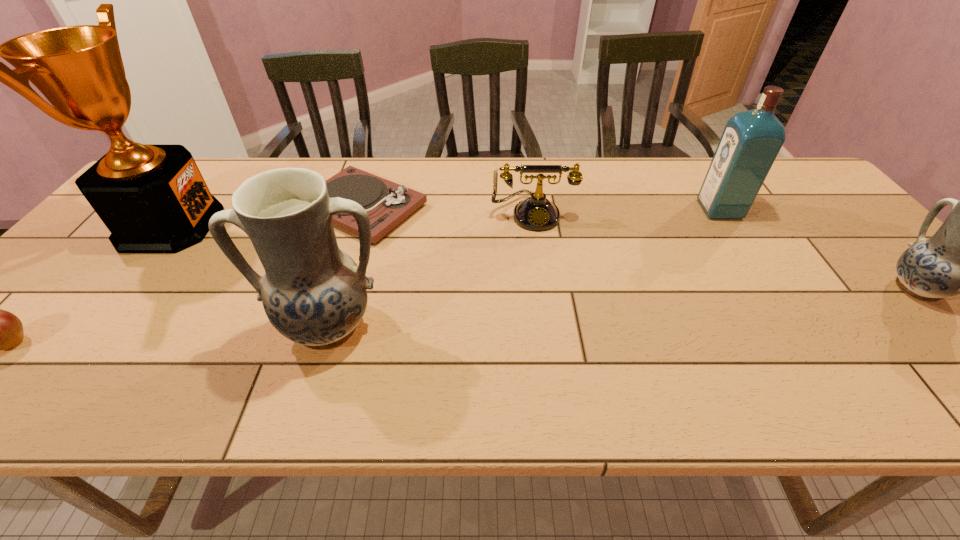
Locate an element on the screen. free spot located 0.310m on the front of the tallest object with the label is located at coordinates (327, 225).

Where is `vacant space situated 0.130m on the left of the shortest object`? This screenshot has width=960, height=540. vacant space situated 0.130m on the left of the shortest object is located at coordinates (253, 208).

This screenshot has width=960, height=540. What are the coordinates of `blank space located 0.310m on the dial of the fifth tallest object` in the screenshot? It's located at (548, 321).

Identify the location of liquor that is positioned at the far edge. The image size is (960, 540). (751, 140).

This screenshot has width=960, height=540. Find the location of `trophy cup that is positioned at the far edge`. trophy cup that is positioned at the far edge is located at coordinates (152, 198).

This screenshot has width=960, height=540. Find the location of `phonograph_record that is positioned at the far edge`. phonograph_record that is positioned at the far edge is located at coordinates (387, 204).

Locate an element on the screen. The image size is (960, 540). telephone present at the far edge is located at coordinates (537, 213).

Where is `object present at the near edge`? This screenshot has height=540, width=960. object present at the near edge is located at coordinates (313, 293).

Identify the location of object present at the left edge. This screenshot has height=540, width=960. (152, 198).

Image resolution: width=960 pixels, height=540 pixels. I want to click on object located in the far left corner section of the desktop, so click(152, 198).